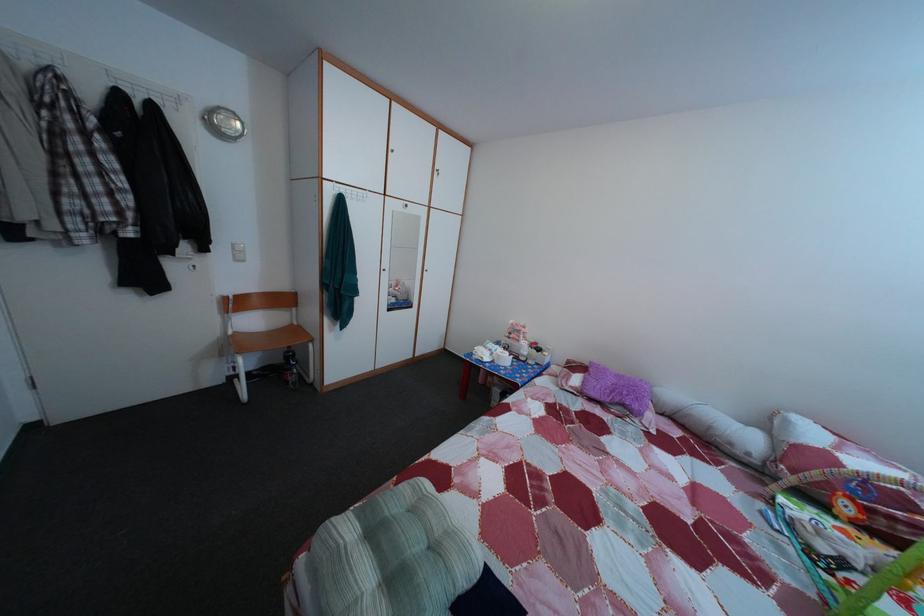
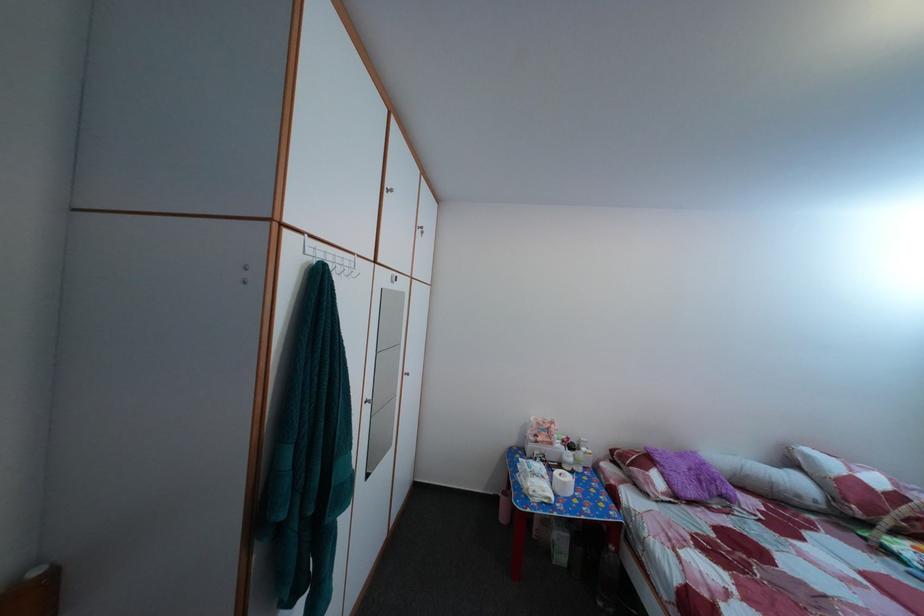
Find the pixel in the second image that matches point (489, 362) in the first image.

(551, 500)